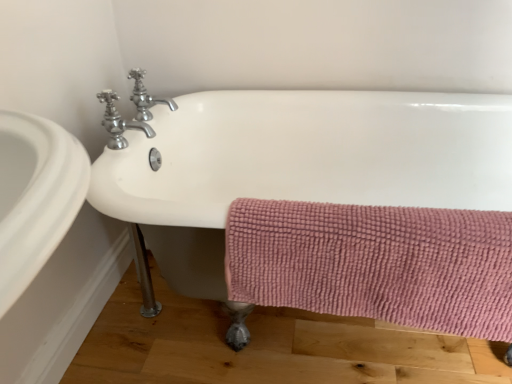
Where is `free space in front of polished chrome faucet at upper left, which is counted as the 2th tap, starting from the back`? free space in front of polished chrome faucet at upper left, which is counted as the 2th tap, starting from the back is located at coordinates (108, 177).